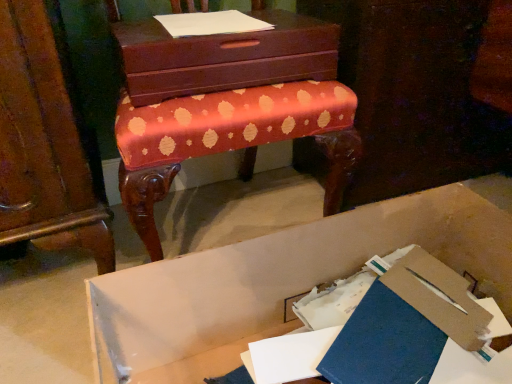
Question: Considering their positions, is blue matte paper at lower center located in front of or behind white cardboard box at lower center?

Choices:
 (A) behind
 (B) front

Answer: (A)

Question: Is blue matte paper at lower center inside or outside of white cardboard box at lower center?

Choices:
 (A) outside
 (B) inside

Answer: (B)

Question: Which is farther from the blue matte paper at lower center?

Choices:
 (A) matte brown chest of drawers at upper center
 (B) white paper at upper center
 (C) white cardboard box at lower center

Answer: (B)

Question: Considering the real-world distances, which object is closest to the white cardboard box at lower center?

Choices:
 (A) matte brown chest of drawers at upper center
 (B) blue matte paper at lower center
 (C) white paper at upper center

Answer: (B)